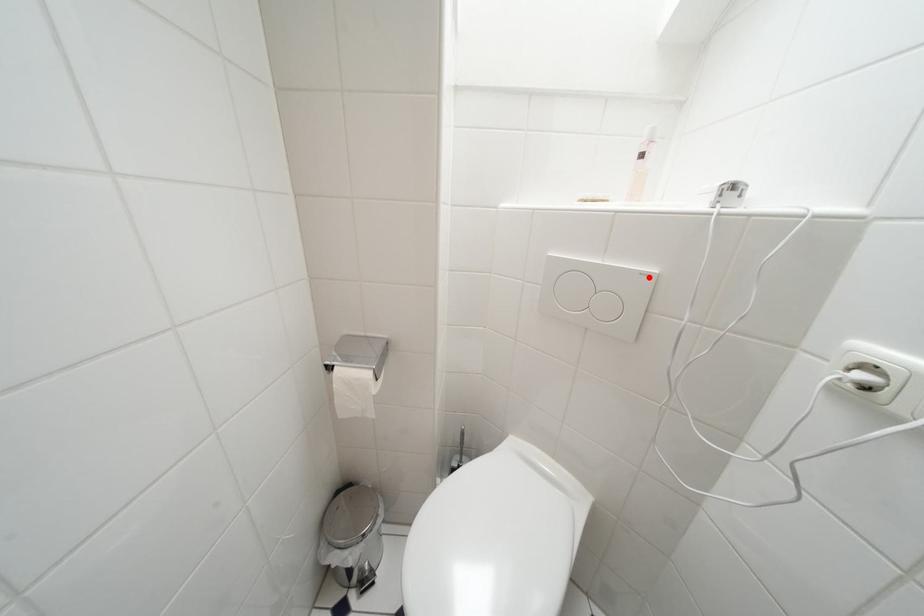
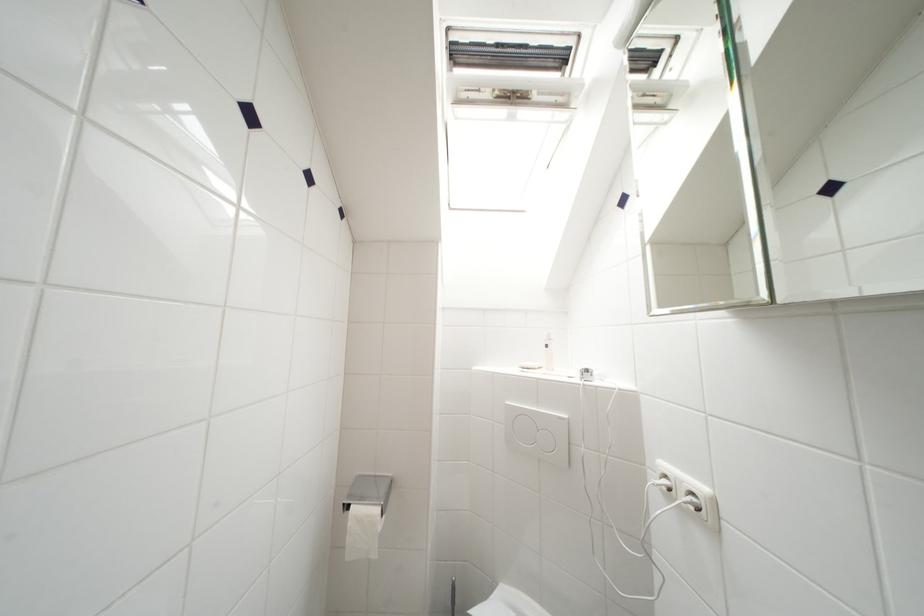
Find the pixel in the second image that matches the highlighted location in the first image.

(565, 421)